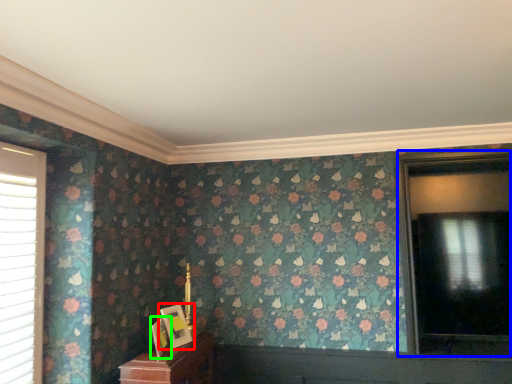
Question: Considering the real-world distances, which object is closest to picture frame (highlighted by a red box)? window (highlighted by a blue box) or picture frame (highlighted by a green box).

Choices:
 (A) window
 (B) picture frame

Answer: (B)